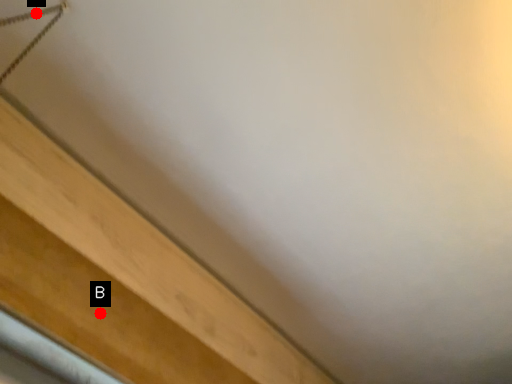
Question: Two points are circled on the image, labeled by A and B beside each circle. Which point is further to the camera?

Choices:
 (A) A is further
 (B) B is further

Answer: (B)